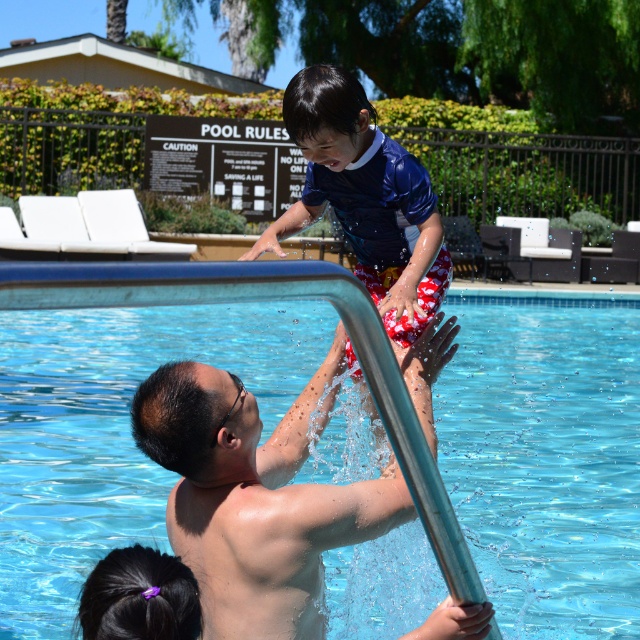
Is point (298, 486) more distant than point (125, 637)?

That is True.

Is shiny silver pole at center shorter than purple hairband at lower left?

In fact, shiny silver pole at center may be taller than purple hairband at lower left.

Who is more distant from viewer, (292, 547) or (124, 595)?

The point (292, 547) is more distant.

The width and height of the screenshot is (640, 640). Find the location of `shiny silver pole at center`. shiny silver pole at center is located at coordinates (256, 497).

Does clear blue water at center have a lesser height compared to purple hairband at lower left?

No.

Is clear blue water at center further to camera compared to purple hairband at lower left?

That is False.

Between point (483, 577) and point (172, 614), which one is positioned in front?

Point (172, 614) is in front.

The height and width of the screenshot is (640, 640). I want to click on clear blue water at center, so click(x=124, y=403).

From the picture: Is clear blue water at center to the right of shiny silver pole at center from the viewer's perspective?

No, clear blue water at center is not to the right of shiny silver pole at center.

Who is positioned more to the left, clear blue water at center or shiny silver pole at center?

clear blue water at center is more to the left.

You are a GUI agent. You are given a task and a screenshot of the screen. Output one action in this format:
    pyautogui.click(x=<x>, y=<y>)
    Task: Click on the clear blue water at center
    The image size is (640, 640).
    Given the screenshot: What is the action you would take?
    pyautogui.click(x=124, y=403)

Where is `clear blue water at center`? The height and width of the screenshot is (640, 640). clear blue water at center is located at coordinates (124, 403).